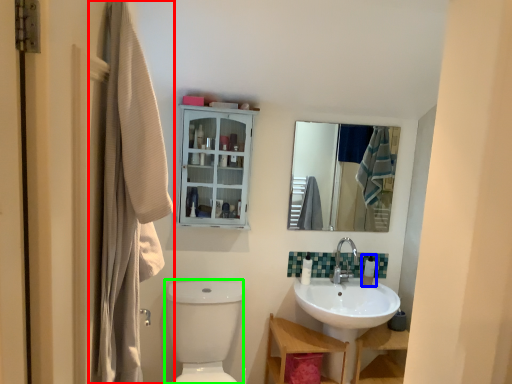
Question: Which is farther away from laundry (highlighted by a red box)? toiletry (highlighted by a blue box) or toilet bowl (highlighted by a green box)?

Choices:
 (A) toiletry
 (B) toilet bowl

Answer: (A)